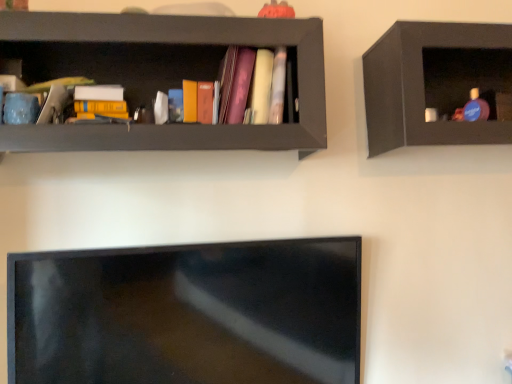
Question: Does matte black shelf at upper right, positioned as the first shelf in right-to-left order, come behind matte black shelf at upper left, positioned as the second shelf in right-to-left order?

Choices:
 (A) no
 (B) yes

Answer: (B)

Question: From a real-world perspective, does matte black shelf at upper right, positioned as the first shelf in right-to-left order, sit lower than matte black shelf at upper left, the 1th shelf viewed from the left?

Choices:
 (A) yes
 (B) no

Answer: (A)

Question: From a real-world perspective, is matte black shelf at upper right, positioned as the first shelf in right-to-left order, on matte black shelf at upper left, positioned as the second shelf in right-to-left order?

Choices:
 (A) no
 (B) yes

Answer: (A)

Question: Is matte black shelf at upper right, which is the 2th shelf from left to right, positioned with its back to matte black shelf at upper left, the 1th shelf viewed from the left?

Choices:
 (A) no
 (B) yes

Answer: (A)

Question: Does matte black shelf at upper right, which is the 2th shelf from left to right, have a greater height compared to matte black shelf at upper left, the 1th shelf viewed from the left?

Choices:
 (A) yes
 (B) no

Answer: (B)

Question: Considering the positions of point (202, 135) and point (283, 52), is point (202, 135) closer or farther from the camera than point (283, 52)?

Choices:
 (A) farther
 (B) closer

Answer: (B)

Question: In terms of height, does matte black shelf at upper left, positioned as the second shelf in right-to-left order, look taller or shorter compared to matte pink book at center?

Choices:
 (A) short
 (B) tall

Answer: (B)

Question: From a real-world perspective, is matte black shelf at upper left, the 1th shelf viewed from the left, above or below matte pink book at center?

Choices:
 (A) below
 (B) above

Answer: (A)

Question: Considering their positions, is matte black shelf at upper left, the 1th shelf viewed from the left, located in front of or behind matte pink book at center?

Choices:
 (A) front
 (B) behind

Answer: (A)

Question: From a real-world perspective, is matte black shelf at upper right, positioned as the first shelf in right-to-left order, physically located above or below matte pink book at center?

Choices:
 (A) below
 (B) above

Answer: (A)

Question: Visually, is matte black shelf at upper right, which is the 2th shelf from left to right, positioned to the left or to the right of matte pink book at center?

Choices:
 (A) left
 (B) right

Answer: (B)

Question: From their relative heights in the image, would you say matte black shelf at upper right, positioned as the first shelf in right-to-left order, is taller or shorter than matte pink book at center?

Choices:
 (A) tall
 (B) short

Answer: (A)

Question: In terms of size, does matte black shelf at upper right, which is the 2th shelf from left to right, appear bigger or smaller than matte pink book at center?

Choices:
 (A) big
 (B) small

Answer: (A)

Question: From a real-world perspective, is matte black shelf at upper right, positioned as the first shelf in right-to-left order, above or below matte black shelf at upper left, positioned as the second shelf in right-to-left order?

Choices:
 (A) below
 (B) above

Answer: (A)

Question: In terms of width, does matte black shelf at upper right, which is the 2th shelf from left to right, look wider or thinner when compared to matte black shelf at upper left, positioned as the second shelf in right-to-left order?

Choices:
 (A) wide
 (B) thin

Answer: (B)